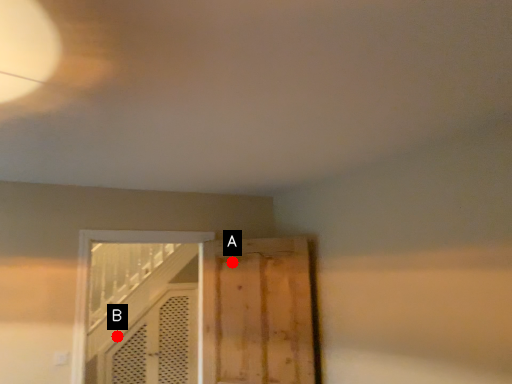
Question: Two points are circled on the image, labeled by A and B beside each circle. Among these points, which one is farthest from the camera?

Choices:
 (A) A is further
 (B) B is further

Answer: (B)